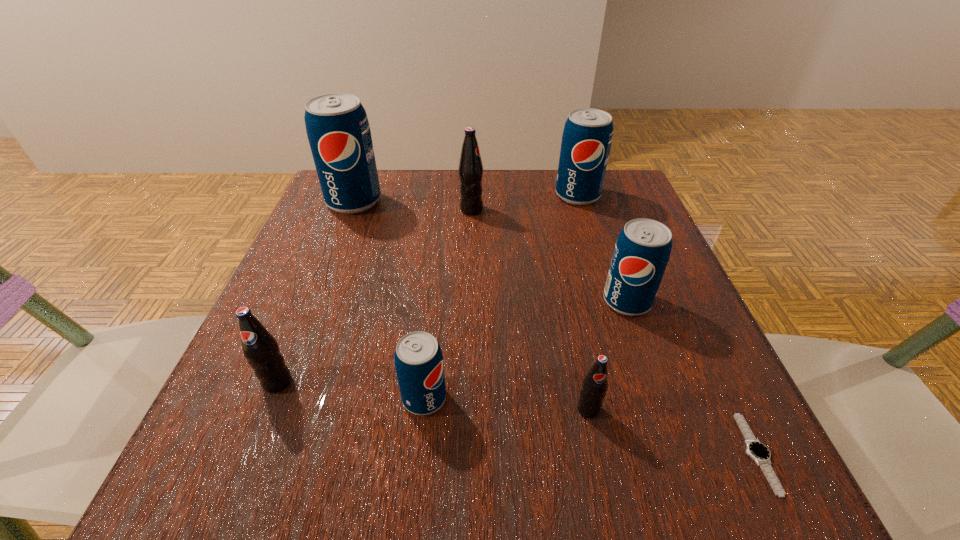
You are a GUI agent. You are given a task and a screenshot of the screen. Output one action in this format:
    pyautogui.click(x=<x>, y=<y>)
    Task: Click on the vacant space that satisfies the following two spatial constraints: 1. on the front label of the nearest blue pop; 2. on the left side of the leftmost black pop
    This screenshot has height=540, width=960.
    Given the screenshot: What is the action you would take?
    pyautogui.click(x=272, y=398)

Find the location of a particular element. vacant space that satisfies the following two spatial constraints: 1. on the back side of the third biggest blue pop; 2. on the front label of the farthest black pop is located at coordinates (595, 210).

Where is `free location that satisfies the following two spatial constraints: 1. on the front label of the third farthest blue pop; 2. on the left side of the farthest black pop`? The image size is (960, 540). free location that satisfies the following two spatial constraints: 1. on the front label of the third farthest blue pop; 2. on the left side of the farthest black pop is located at coordinates (469, 301).

Locate an element on the screen. The width and height of the screenshot is (960, 540). vacant space that satisfies the following two spatial constraints: 1. on the front label of the fourth pop from left to right; 2. on the front label of the second nearest black pop is located at coordinates (467, 382).

Locate an element on the screen. This screenshot has height=540, width=960. vacant region that satisfies the following two spatial constraints: 1. on the front label of the shortest object; 2. on the left side of the second black pop from left to right is located at coordinates (466, 453).